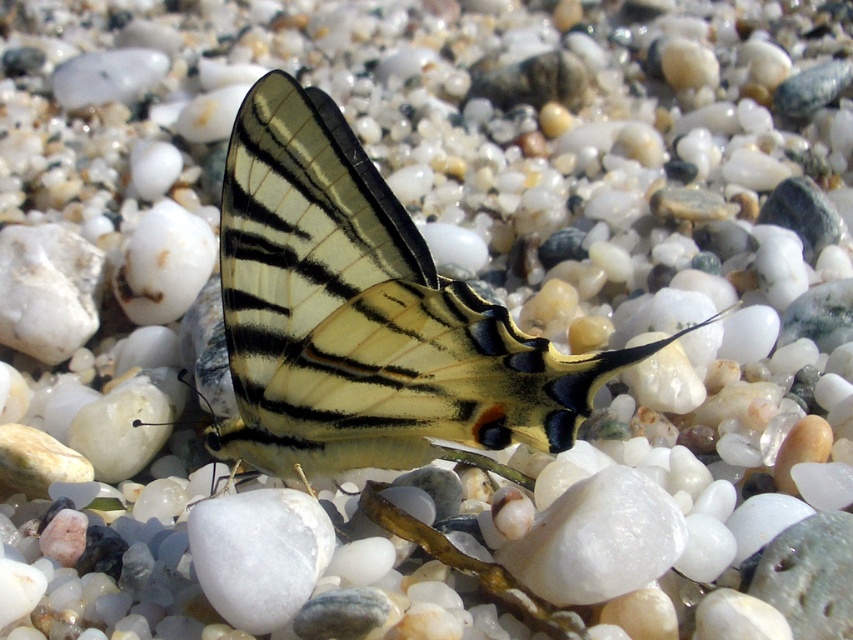
Question: Considering the relative positions of yellowish-green iridescent wings at center and white smooth rock at center in the image provided, where is yellowish-green iridescent wings at center located with respect to white smooth rock at center?

Choices:
 (A) above
 (B) below

Answer: (A)

Question: From the image, what is the correct spatial relationship of yellowish-green iridescent wings at center in relation to white smooth rock at center?

Choices:
 (A) below
 (B) above

Answer: (B)

Question: Is yellowish-green iridescent wings at center bigger than white smooth rock at center?

Choices:
 (A) no
 (B) yes

Answer: (B)

Question: Among these objects, which one is farthest from the camera?

Choices:
 (A) white smooth rock at center
 (B) yellowish-green iridescent wings at center

Answer: (A)